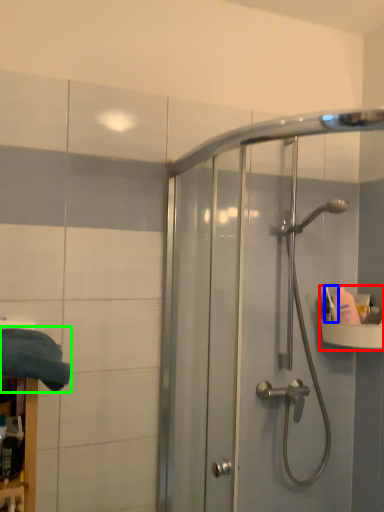
Question: Which is nearer to the sink (highlighted by a red box)? toiletry (highlighted by a blue box) or bath towel (highlighted by a green box).

Choices:
 (A) toiletry
 (B) bath towel

Answer: (A)